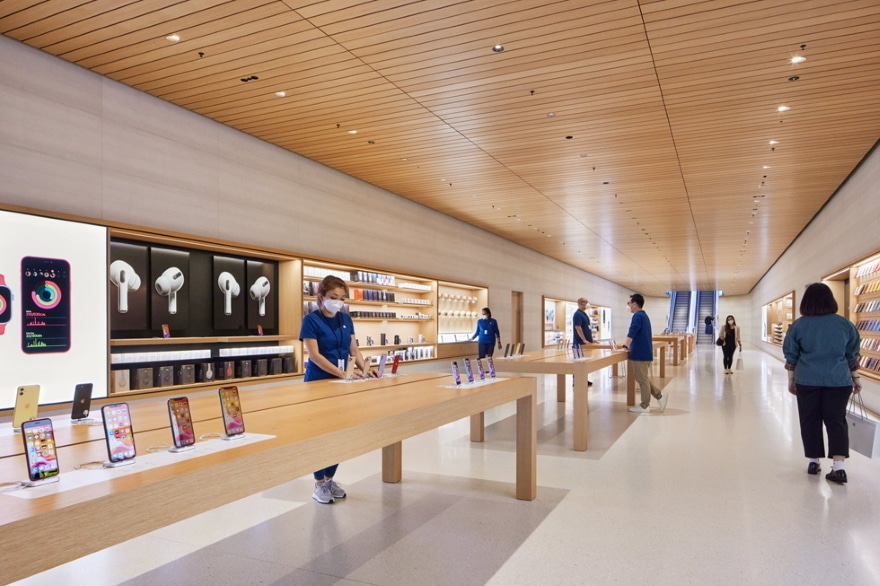
You are a GUI agent. You are given a task and a screenshot of the screen. Output one action in this format:
    pyautogui.click(x=<x>, y=<y>)
    Task: Click on the table
    This screenshot has width=880, height=586.
    Given the screenshot: What is the action you would take?
    pyautogui.click(x=363, y=398)